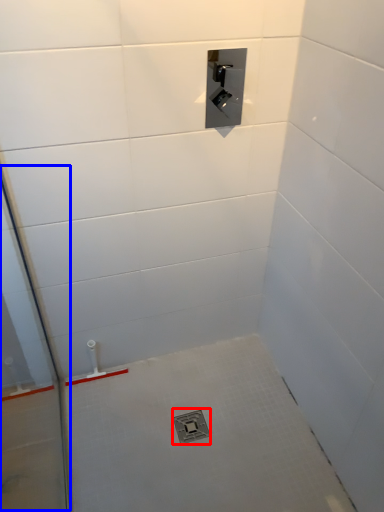
Question: Which object appears farthest to the camera in this image, drain (highlighted by a red box) or glass door (highlighted by a blue box)?

Choices:
 (A) drain
 (B) glass door

Answer: (A)